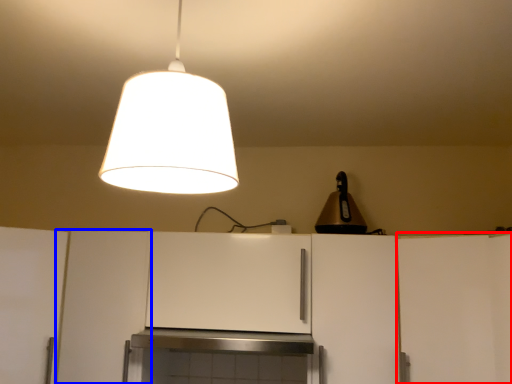
Question: Which object appears farthest to the camera in this image, cabinetry (highlighted by a red box) or cabinetry (highlighted by a blue box)?

Choices:
 (A) cabinetry
 (B) cabinetry

Answer: (B)